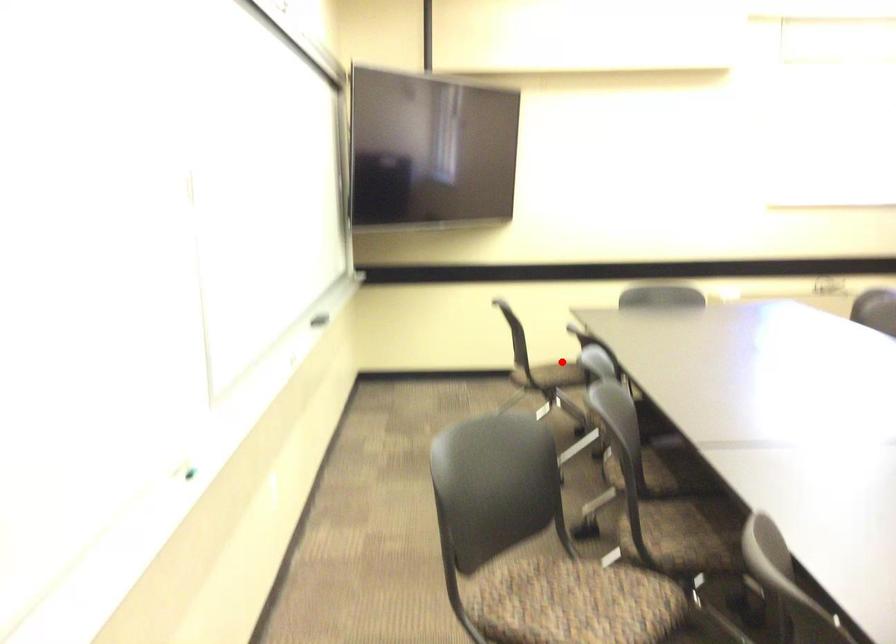
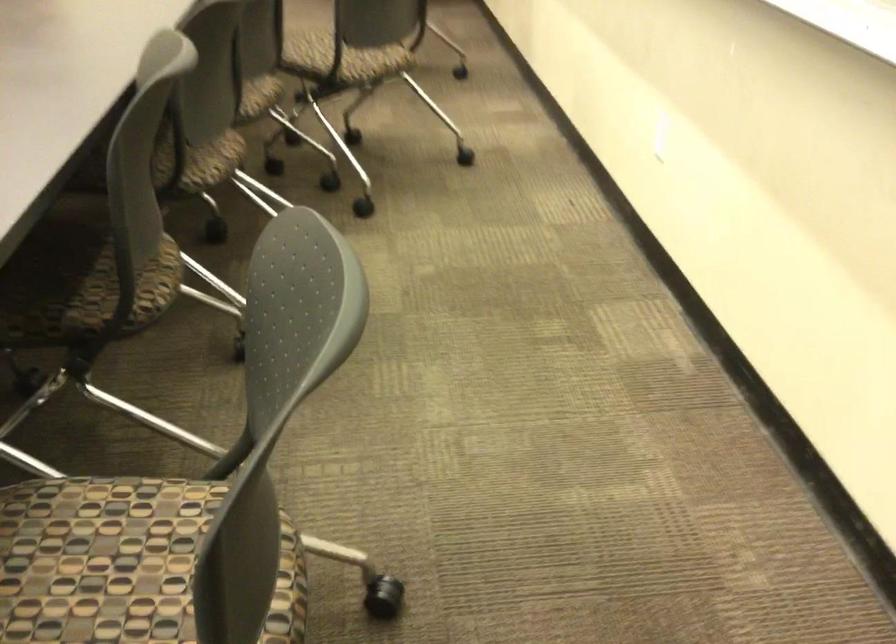
In the second image, find the point that corresponds to the highlighted location in the first image.

(99, 556)